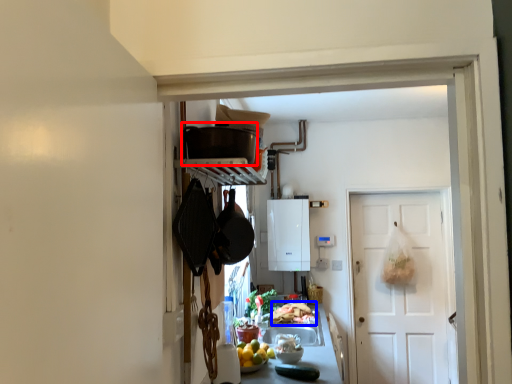
Question: Which object is further to the camera taking this photo, appliance (highlighted by a red box) or food (highlighted by a blue box)?

Choices:
 (A) appliance
 (B) food

Answer: (B)